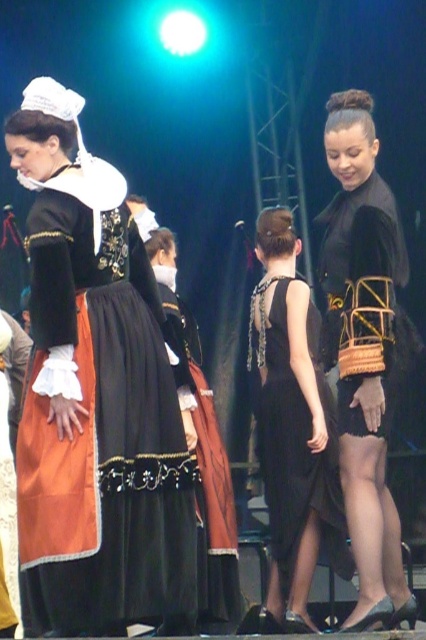
You are standing in the performance area and need to reach a prop located at point (337,212). There is an obstacle at point (11,161). Will you encounter the obstacle before reaching the prop?

Yes, you will encounter the obstacle at point (11,161) before reaching the prop at point (337,212) because point (11,161) is closer to the viewer.

You are an event photographer trying to capture the cultural performance. You need to focus your camera on the matte black dress at left and the black woven basket at center. According to the scene, which object is positioned lower in the image?

The matte black dress at left is located below the black woven basket at center, so it is positioned lower in the image.

You are an event organizer trying to arrange the black matte dress at center and the black woven basket at center for a display. According to the image, which object should be placed to the left side of the display?

The black woven basket at center should be placed to the left side of the display because the black matte dress at center is to the right of it in the original image.